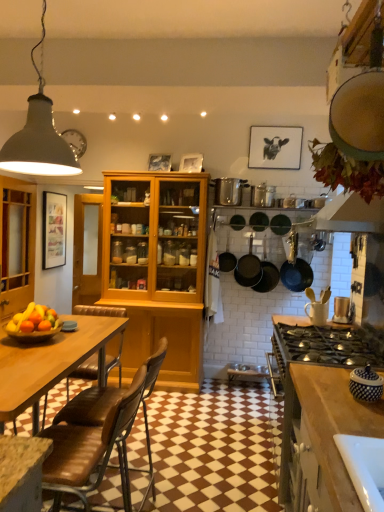
Question: Is wooden cabinet at left not near white textured jar at lower right, the second appliance in the left-to-right sequence?

Choices:
 (A) yes
 (B) no

Answer: (A)

Question: Does wooden cabinet at left have a lesser height compared to white textured jar at lower right, the third appliance when ordered from back to front?

Choices:
 (A) no
 (B) yes

Answer: (A)

Question: Does wooden cabinet at left have a greater height compared to white textured jar at lower right, which appears as the 2th appliance when viewed from the right?

Choices:
 (A) yes
 (B) no

Answer: (A)

Question: Does wooden cabinet at left come in front of white textured jar at lower right, which appears as the 2th appliance when viewed from the right?

Choices:
 (A) no
 (B) yes

Answer: (A)

Question: Is wooden cabinet at left looking in the opposite direction of white textured jar at lower right, which appears as the 2th appliance when viewed from the right?

Choices:
 (A) no
 (B) yes

Answer: (A)

Question: Is the depth of wooden cabinet at left greater than that of white textured jar at lower right, the third appliance in the top-to-bottom sequence?

Choices:
 (A) yes
 (B) no

Answer: (A)

Question: From a real-world perspective, is metallic silver toaster at right, the second appliance in the back-to-front sequence, under wooden cabinet at left?

Choices:
 (A) no
 (B) yes

Answer: (B)

Question: Is metallic silver toaster at right, acting as the second appliance starting from the front, at the left side of wooden cabinet at left?

Choices:
 (A) yes
 (B) no

Answer: (B)

Question: Does metallic silver toaster at right, placed as the 2th appliance when sorted from bottom to top, have a larger size compared to wooden cabinet at left?

Choices:
 (A) yes
 (B) no

Answer: (B)

Question: From the image's perspective, is metallic silver toaster at right, placed as the 2th appliance when sorted from bottom to top, located above wooden cabinet at left?

Choices:
 (A) no
 (B) yes

Answer: (A)

Question: Is metallic silver toaster at right, acting as the second appliance starting from the front, to the right of wooden cabinet at left from the viewer's perspective?

Choices:
 (A) no
 (B) yes

Answer: (B)

Question: Can you confirm if metallic silver toaster at right, which appears as the third appliance when viewed from the left, is shorter than wooden cabinet at left?

Choices:
 (A) no
 (B) yes

Answer: (B)

Question: Is matte black frying pan at center, which is the 2th frying pan from right to left, thinner than brown leather chair at lower left?

Choices:
 (A) no
 (B) yes

Answer: (B)